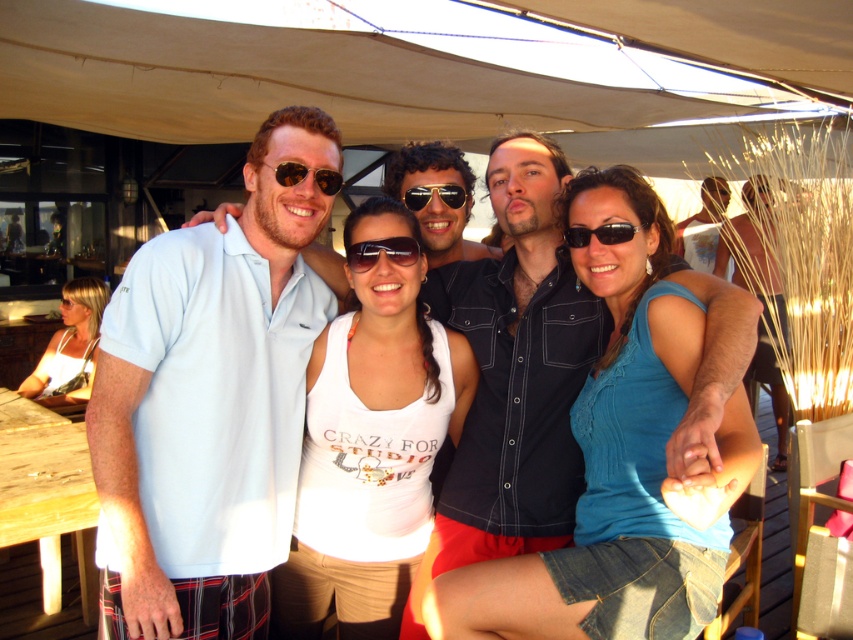
Does beige fabric canopy at upper center have a lesser height compared to sunglasses at center?

No, beige fabric canopy at upper center is not shorter than sunglasses at center.

Can you confirm if beige fabric canopy at upper center is wider than sunglasses at center?

Correct, the width of beige fabric canopy at upper center exceeds that of sunglasses at center.

The height and width of the screenshot is (640, 853). What do you see at coordinates (408, 65) in the screenshot?
I see `beige fabric canopy at upper center` at bounding box center [408, 65].

Where is `beige fabric canopy at upper center`? beige fabric canopy at upper center is located at coordinates (408, 65).

You are a GUI agent. You are given a task and a screenshot of the screen. Output one action in this format:
    pyautogui.click(x=<x>, y=<y>)
    Task: Click on the matte black sunglasses at upper center
    This screenshot has height=640, width=853.
    Given the screenshot: What is the action you would take?
    coord(305,176)

Find the location of `matte black sunglasses at upper center`. matte black sunglasses at upper center is located at coordinates point(305,176).

Who is positioned more to the left, matte white tank top at lower left or sunglasses at center?

Positioned to the left is matte white tank top at lower left.

Does matte white tank top at lower left appear under sunglasses at center?

Indeed, matte white tank top at lower left is positioned under sunglasses at center.

Is point (67, 298) more distant than point (404, 196)?

Yes, point (67, 298) is behind point (404, 196).

Identify the location of matte white tank top at lower left. The width and height of the screenshot is (853, 640). (70, 348).